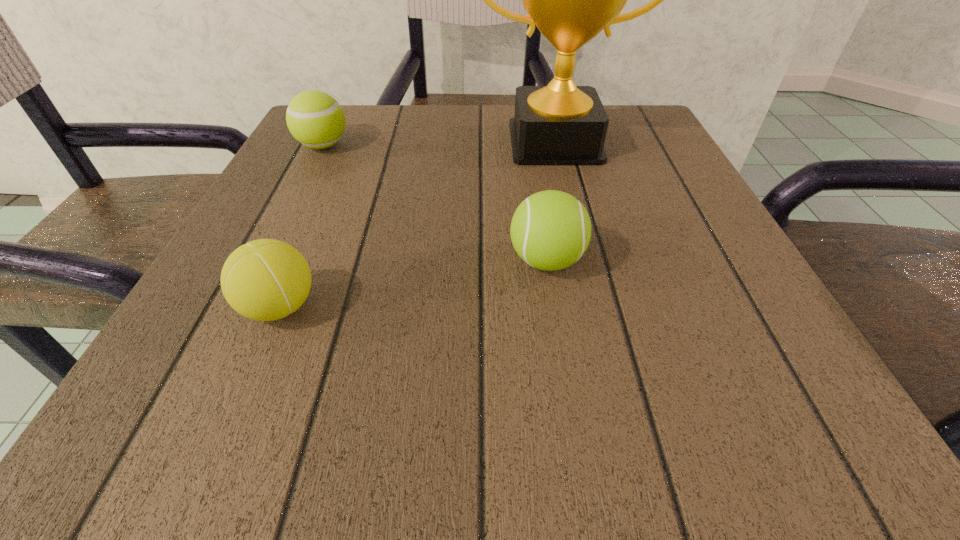
In order to click on object located in the far right corner section of the desktop in this screenshot , I will do `click(571, 0)`.

Identify the location of free point at the far edge. (405, 121).

Where is `vacant space at the near edge`? vacant space at the near edge is located at coordinates [x=660, y=444].

Image resolution: width=960 pixels, height=540 pixels. What are the coordinates of `free spot at the left edge of the desktop` in the screenshot? It's located at (276, 334).

In the image, there is a desktop. Where is `free space at the right edge`? This screenshot has width=960, height=540. free space at the right edge is located at coordinates click(667, 300).

The width and height of the screenshot is (960, 540). In the image, there is a desktop. In order to click on vacant space at the far left corner in this screenshot , I will do coord(366,124).

The height and width of the screenshot is (540, 960). In order to click on vacant area at the near left corner of the desktop in this screenshot , I will do `click(173, 410)`.

Identify the location of blank space at the far right corner of the desktop. (636, 143).

Locate an element on the screen. Image resolution: width=960 pixels, height=540 pixels. free spot between the award and the farthest tennis ball is located at coordinates (439, 144).

Locate an element on the screen. This screenshot has height=540, width=960. free spot between the rightmost tennis ball and the farthest tennis ball is located at coordinates (435, 203).